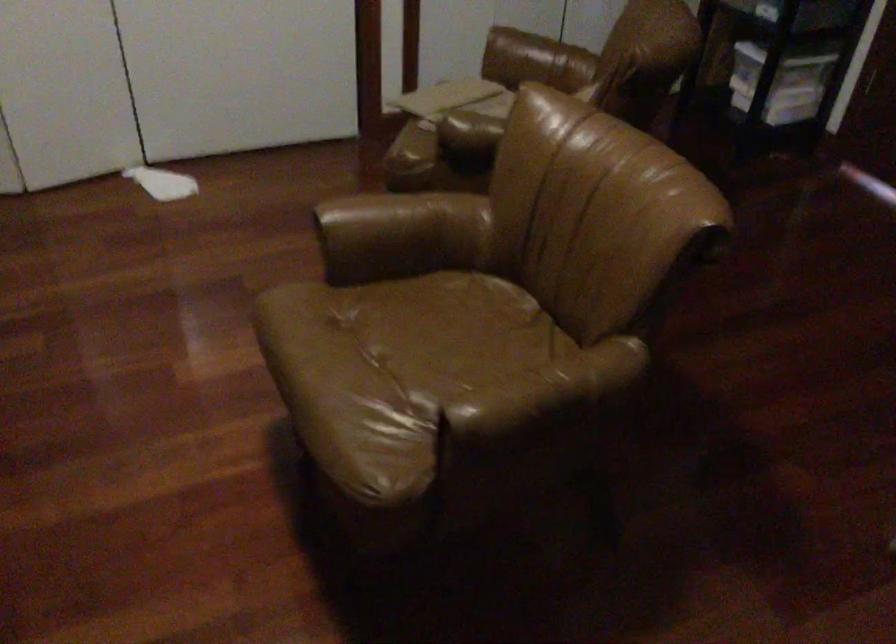
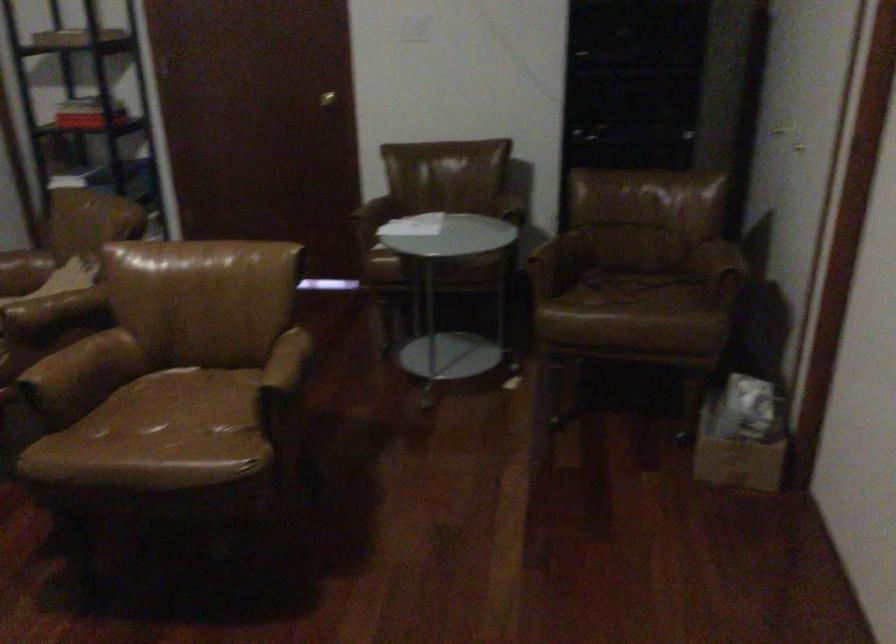
Find the pixel in the second image that matches point (513, 400) in the first image.

(283, 371)